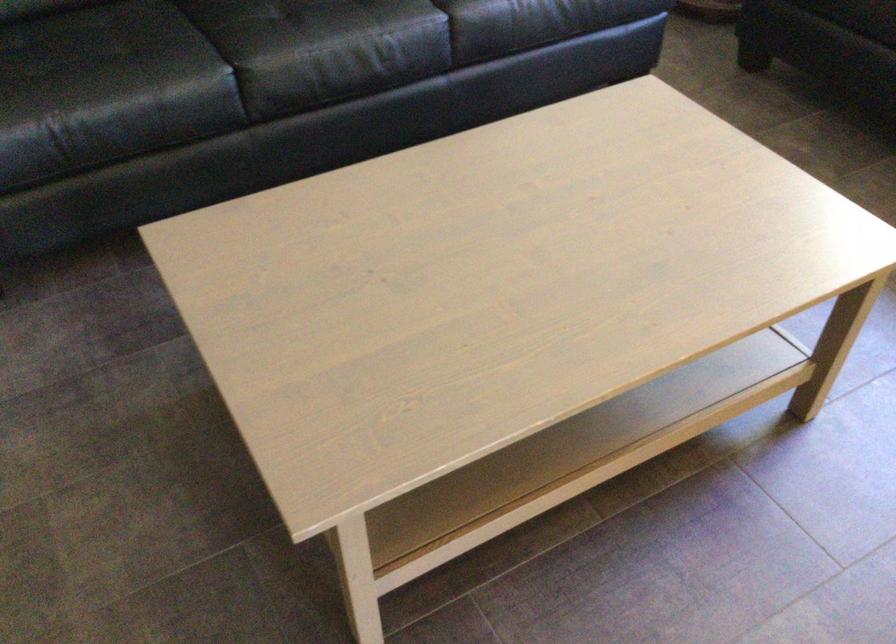
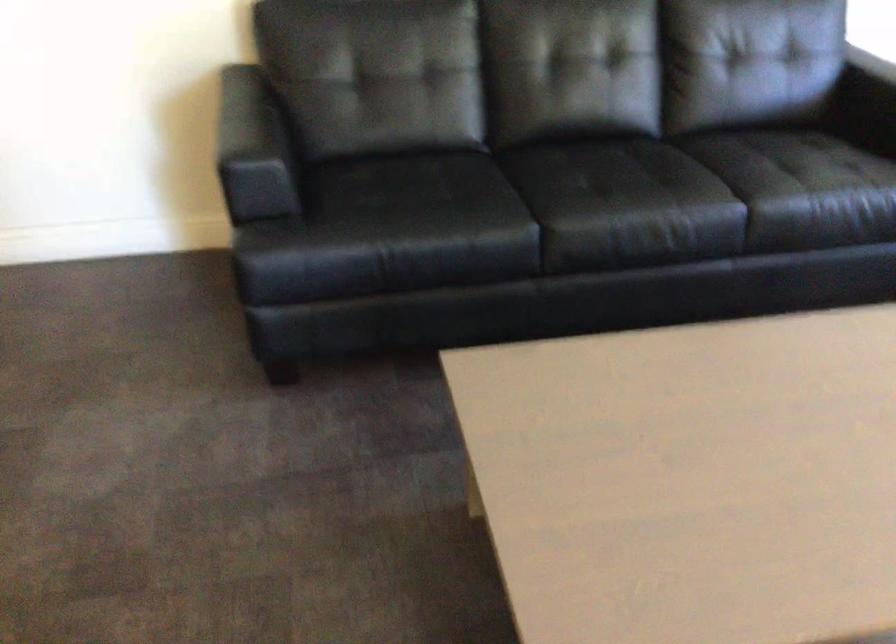
Question: The images are taken continuously from a first-person perspective. In which direction is your viewpoint rotating?

Choices:
 (A) Left
 (B) Right
 (C) Up
 (D) Down

Answer: (A)